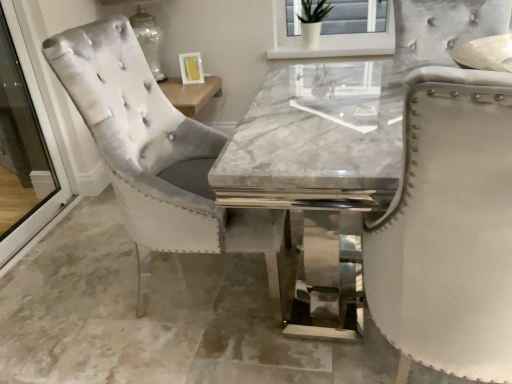
The height and width of the screenshot is (384, 512). Find the location of `free location to the right of clear glass screen door at left`. free location to the right of clear glass screen door at left is located at coordinates (70, 237).